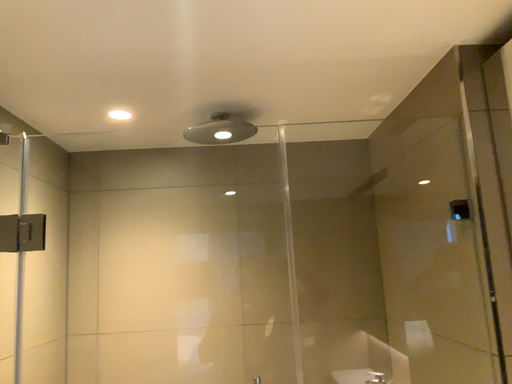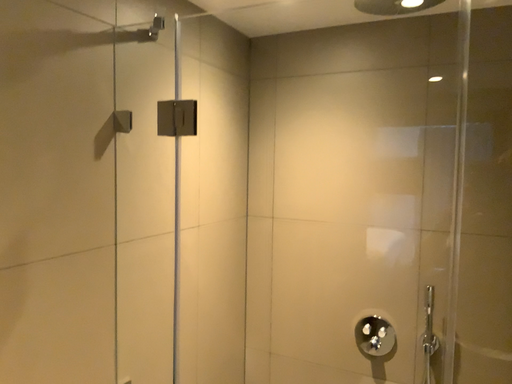
Question: How did the camera likely rotate when shooting the video?

Choices:
 (A) rotated left
 (B) rotated right

Answer: (A)